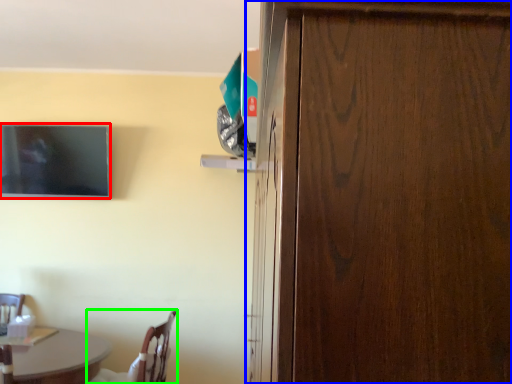
Question: Which object is the closest to the television (highlighted by a red box)? Choose among these: door (highlighted by a blue box) or chair (highlighted by a green box).

Choices:
 (A) door
 (B) chair

Answer: (B)